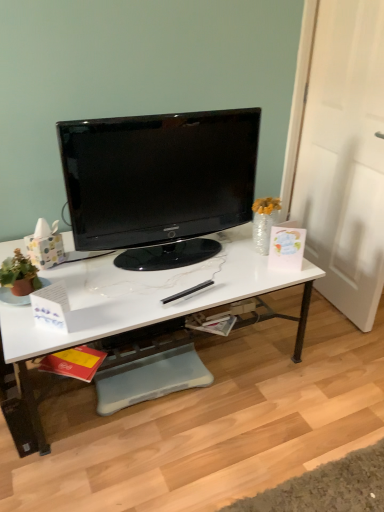
Identify the location of vacant region in front of black glossy television at center. (147, 295).